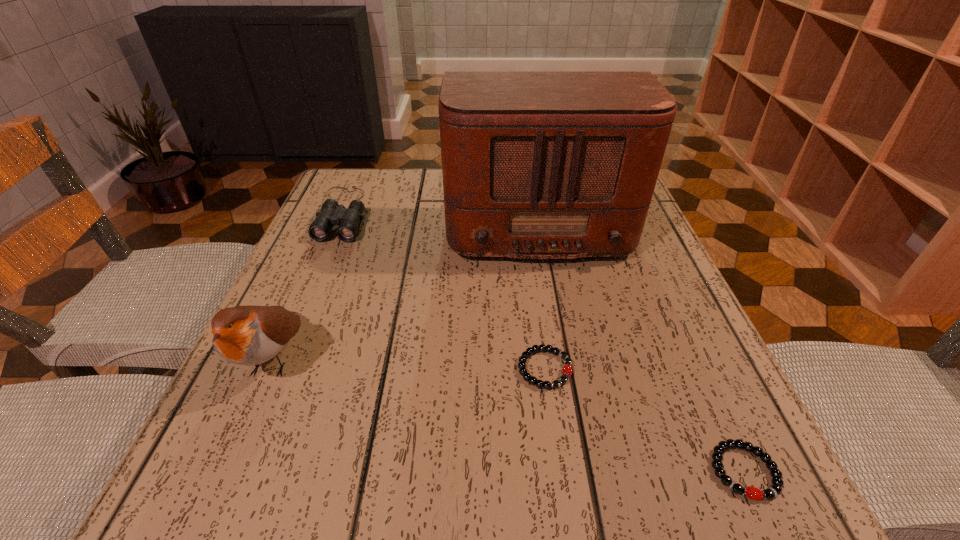
Identify the location of object that is at the near right corner. [x=774, y=490].

Locate an element on the screen. Image resolution: width=960 pixels, height=540 pixels. vacant region at the far edge of the desktop is located at coordinates (400, 172).

Image resolution: width=960 pixels, height=540 pixels. In order to click on free space at the near edge of the desktop in this screenshot , I will do `click(638, 494)`.

This screenshot has height=540, width=960. Identify the location of blank space at the left edge. (270, 369).

The width and height of the screenshot is (960, 540). In order to click on free space at the right edge of the desktop in this screenshot , I will do `click(650, 298)`.

You are a GUI agent. You are given a task and a screenshot of the screen. Output one action in this format:
    pyautogui.click(x=<x>, y=<y>)
    Task: Click on the free space at the far left corner of the desktop
    
    Given the screenshot: What is the action you would take?
    pyautogui.click(x=347, y=207)

Identify the location of free space between the binoculars and the radio receiver. This screenshot has width=960, height=540. (440, 217).

Locate an element on the screen. free space that is in between the left bracelet and the nearest object is located at coordinates (644, 420).

Locate an element on the screen. The height and width of the screenshot is (540, 960). unoccupied area between the radio receiver and the right bracelet is located at coordinates (640, 346).

The height and width of the screenshot is (540, 960). I want to click on vacant space that is in between the binoculars and the nearer bracelet, so click(543, 342).